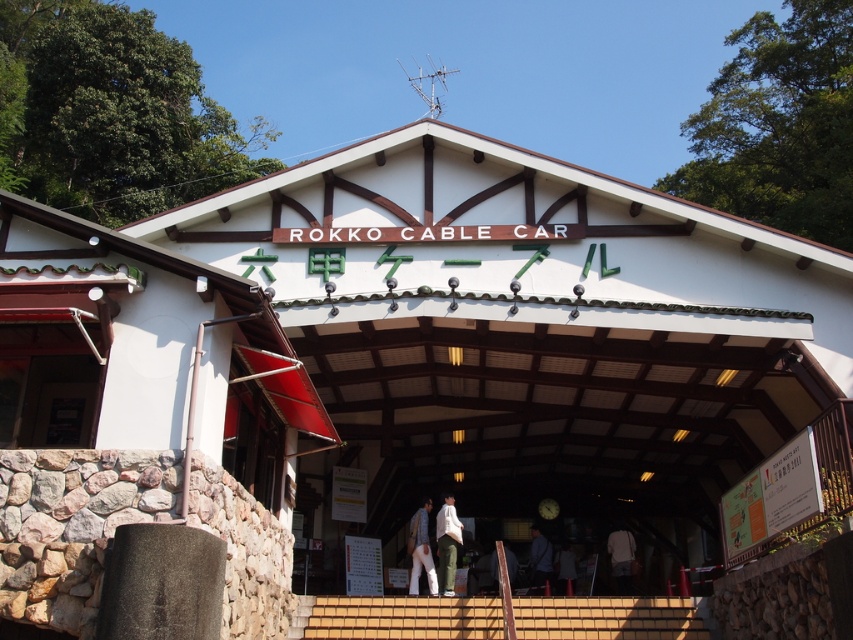
Question: Does brown tile stairs at center appear under light blue jeans at center?

Choices:
 (A) yes
 (B) no

Answer: (B)

Question: Does brown tile stairs at center have a lesser width compared to white fabric at center?

Choices:
 (A) no
 (B) yes

Answer: (A)

Question: Which object appears closest to the camera in this image?

Choices:
 (A) light brown fabric pants at center
 (B) white fabric at center
 (C) green cotton pants at center

Answer: (C)

Question: Which point appears farthest from the camera in this image?

Choices:
 (A) (550, 561)
 (B) (614, 532)
 (C) (556, 564)

Answer: (B)

Question: Does green cotton pants at center have a smaller size compared to white fabric at center?

Choices:
 (A) no
 (B) yes

Answer: (B)

Question: Which point is closer to the camera?

Choices:
 (A) (415, 556)
 (B) (567, 561)
 (C) (685, 605)

Answer: (C)